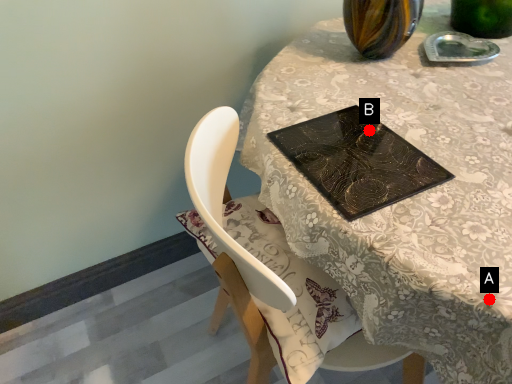
Question: Two points are circled on the image, labeled by A and B beside each circle. Which point is further to the camera?

Choices:
 (A) A is further
 (B) B is further

Answer: (B)